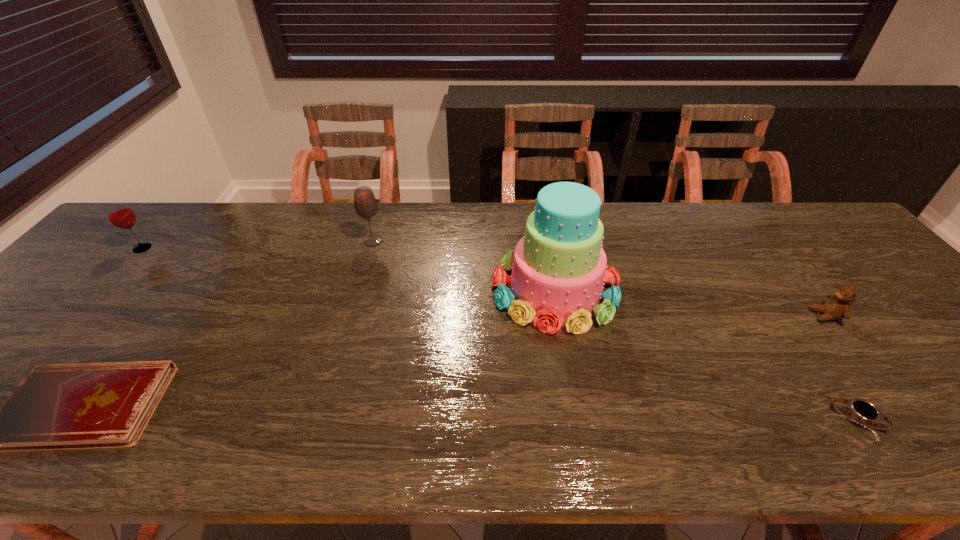
Image resolution: width=960 pixels, height=540 pixels. Find the location of `free space located on the front of the left glass`. free space located on the front of the left glass is located at coordinates (90, 308).

Identify the location of vacant area located at the face of the teddy bear. Image resolution: width=960 pixels, height=540 pixels. (788, 316).

The image size is (960, 540). Find the location of `vacant area situated 0.220m at the face of the teddy bear`. vacant area situated 0.220m at the face of the teddy bear is located at coordinates [724, 316].

The height and width of the screenshot is (540, 960). Identify the location of vacant space located at the face of the teddy bear. (704, 316).

At what (x,y) coordinates should I click in order to perform the action: click on blank space located 0.140m on the right of the fifth tallest object. Please return your answer as a coordinate pair (x, y). Image resolution: width=960 pixels, height=540 pixels. Looking at the image, I should click on (947, 418).

In order to click on object that is at the near edge in this screenshot , I will do `click(864, 412)`.

Find the location of a particular element. object located in the left edge section of the desktop is located at coordinates (120, 214).

Locate an element on the screen. This screenshot has height=540, width=960. object that is at the far left corner is located at coordinates pos(120,214).

Image resolution: width=960 pixels, height=540 pixels. Find the location of `vacant space at the far edge`. vacant space at the far edge is located at coordinates (700, 226).

Where is `vacant space at the near edge`? Image resolution: width=960 pixels, height=540 pixels. vacant space at the near edge is located at coordinates (926, 417).